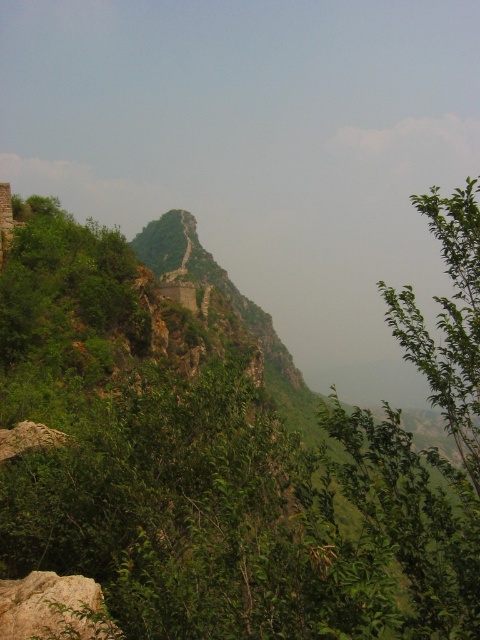
Is green leafy tree at right shorter than smooth gray rock at lower left?

No.

Describe the element at coordinates (447, 320) in the screenshot. The image size is (480, 640). I see `green leafy tree at right` at that location.

At what (x,y) coordinates should I click in order to perform the action: click on green leafy tree at right. Please return your answer as a coordinate pair (x, y). The image size is (480, 640). Looking at the image, I should click on click(447, 320).